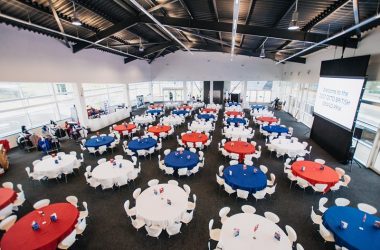
I want to click on ceiling, so click(260, 10).